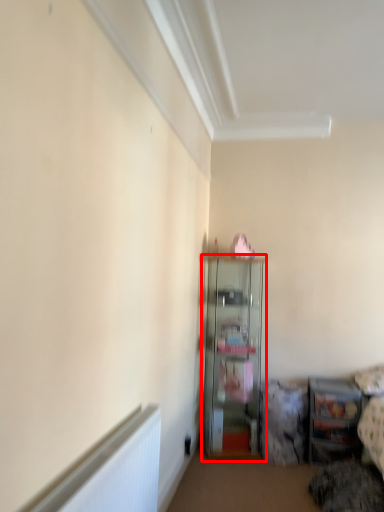
Question: Where is shelf (annotated by the red box) located in relation to shelf in the image?

Choices:
 (A) left
 (B) right

Answer: (A)